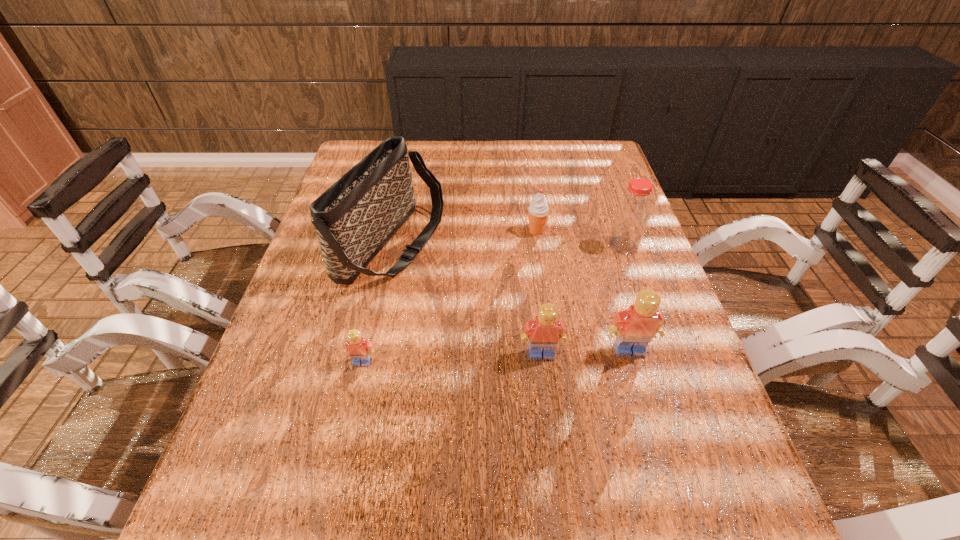
The height and width of the screenshot is (540, 960). I want to click on the shortest Lego, so click(358, 349).

The width and height of the screenshot is (960, 540). Find the location of `the shortest object`. the shortest object is located at coordinates (358, 349).

The height and width of the screenshot is (540, 960). Find the location of `the second shortest Lego`. the second shortest Lego is located at coordinates pyautogui.click(x=546, y=331).

Identify the location of the rightmost Lego. This screenshot has width=960, height=540. (634, 328).

The height and width of the screenshot is (540, 960). I want to click on icecream, so click(538, 211).

Locate an element on the screen. bottle is located at coordinates (632, 214).

Where is `handbag`? The image size is (960, 540). handbag is located at coordinates 354,219.

You are a GUI agent. You are given a task and a screenshot of the screen. Output one action in this format:
    pyautogui.click(x=<x>, y=<y>)
    Task: Click on the free spot located on the front-facing side of the shortest object
    This screenshot has height=540, width=960.
    Given the screenshot: What is the action you would take?
    pyautogui.click(x=354, y=397)

At what (x,y) coordinates should I click in order to perform the action: click on free space located on the front-facing side of the second shortest Lego. Please return your answer as a coordinate pair (x, y). Image resolution: width=960 pixels, height=540 pixels. Looking at the image, I should click on (554, 456).

Image resolution: width=960 pixels, height=540 pixels. Identify the location of free space located on the front-facing side of the rightmost Lego. (655, 436).